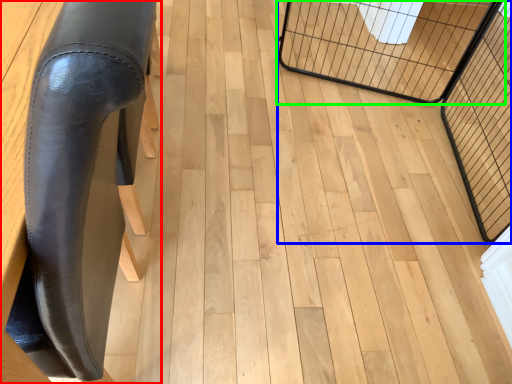
Question: Which object is the farthest from furniture (highlighted by a red box)? Choose among these: cage (highlighted by a blue box) or cage (highlighted by a green box).

Choices:
 (A) cage
 (B) cage

Answer: (B)